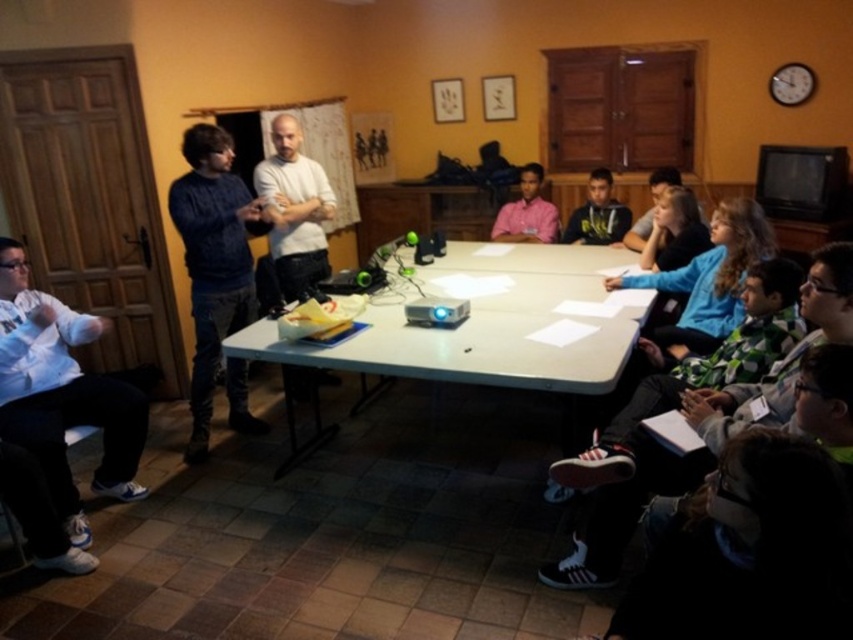
Does point (625, 308) lie behind point (57, 365)?

Yes, it is.

Is white plastic table at center thinner than white cotton shirt at lower left?

No.

The height and width of the screenshot is (640, 853). What do you see at coordinates (489, 326) in the screenshot? I see `white plastic table at center` at bounding box center [489, 326].

Locate an element on the screen. white plastic table at center is located at coordinates (489, 326).